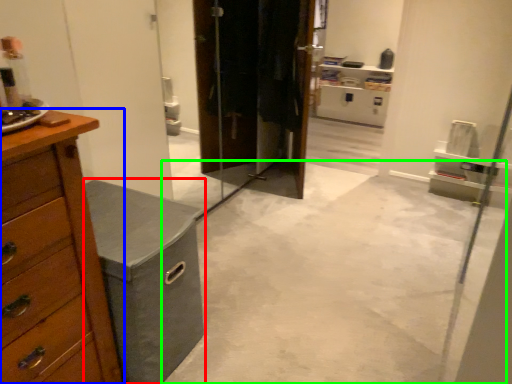
Question: Based on their relative distances, which object is nearer to vanity (highlighted by a red box)? Choose from chest of drawers (highlighted by a blue box) and concrete (highlighted by a green box).

Choices:
 (A) chest of drawers
 (B) concrete

Answer: (A)